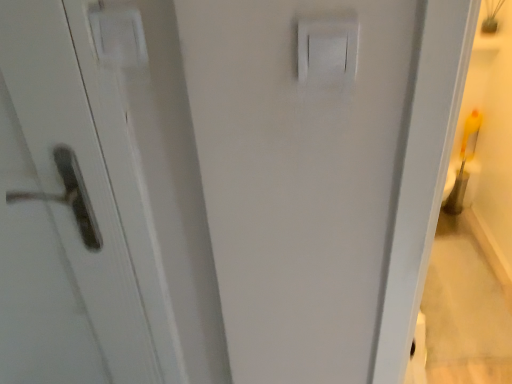
Question: Is white plastic light switch at upper center shorter than matte white handle at left?

Choices:
 (A) no
 (B) yes

Answer: (B)

Question: From a real-world perspective, is white plastic light switch at upper center on top of matte white handle at left?

Choices:
 (A) no
 (B) yes

Answer: (B)

Question: Would you say matte white handle at left is part of white plastic light switch at upper center's contents?

Choices:
 (A) no
 (B) yes

Answer: (A)

Question: Is white plastic light switch at upper center looking in the opposite direction of matte white handle at left?

Choices:
 (A) yes
 (B) no

Answer: (B)

Question: Could you tell me if white plastic light switch at upper center is turned towards matte white handle at left?

Choices:
 (A) no
 (B) yes

Answer: (A)

Question: Can you confirm if white plastic light switch at upper center is smaller than matte white handle at left?

Choices:
 (A) no
 (B) yes

Answer: (B)

Question: Is matte white handle at left far away from white plastic light switch at upper center?

Choices:
 (A) yes
 (B) no

Answer: (B)

Question: From a real-world perspective, is matte white handle at left under white plastic light switch at upper center?

Choices:
 (A) yes
 (B) no

Answer: (A)

Question: Does matte white handle at left come in front of white plastic light switch at upper center?

Choices:
 (A) yes
 (B) no

Answer: (B)

Question: Considering the relative sizes of matte white handle at left and white plastic light switch at upper center in the image provided, is matte white handle at left shorter than white plastic light switch at upper center?

Choices:
 (A) no
 (B) yes

Answer: (A)

Question: Considering the relative positions of matte white handle at left and white plastic light switch at upper center in the image provided, is matte white handle at left to the left of white plastic light switch at upper center from the viewer's perspective?

Choices:
 (A) no
 (B) yes

Answer: (B)

Question: Is matte white handle at left further to camera compared to white plastic light switch at upper center?

Choices:
 (A) no
 (B) yes

Answer: (B)

Question: Considering the positions of white plastic light switch at upper center and matte white handle at left in the image, is white plastic light switch at upper center wider or thinner than matte white handle at left?

Choices:
 (A) wide
 (B) thin

Answer: (B)